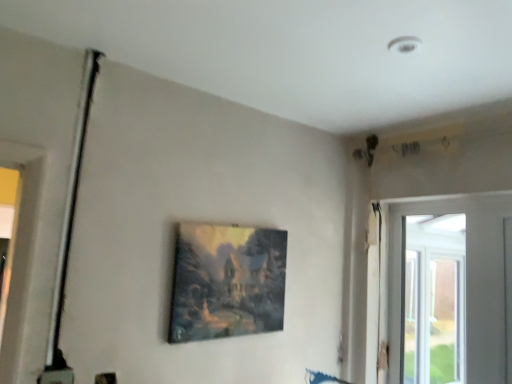
Question: Considering the relative positions of transparent glass window at right and matte wooden picture frame at center in the image provided, is transparent glass window at right to the right of matte wooden picture frame at center from the viewer's perspective?

Choices:
 (A) yes
 (B) no

Answer: (A)

Question: Considering the relative sizes of transparent glass window at right and matte wooden picture frame at center in the image provided, is transparent glass window at right wider than matte wooden picture frame at center?

Choices:
 (A) no
 (B) yes

Answer: (A)

Question: Is transparent glass window at right oriented away from matte wooden picture frame at center?

Choices:
 (A) yes
 (B) no

Answer: (B)

Question: From the image's perspective, does transparent glass window at right appear higher than matte wooden picture frame at center?

Choices:
 (A) yes
 (B) no

Answer: (B)

Question: Considering the relative sizes of transparent glass window at right and matte wooden picture frame at center in the image provided, is transparent glass window at right smaller than matte wooden picture frame at center?

Choices:
 (A) yes
 (B) no

Answer: (B)

Question: Can you confirm if transparent glass window at right is bigger than matte wooden picture frame at center?

Choices:
 (A) yes
 (B) no

Answer: (A)

Question: Is matte wooden picture frame at center not near transparent glass window at right?

Choices:
 (A) no
 (B) yes

Answer: (B)

Question: Is matte wooden picture frame at center to the right of transparent glass window at right from the viewer's perspective?

Choices:
 (A) yes
 (B) no

Answer: (B)

Question: Is matte wooden picture frame at center behind transparent glass window at right?

Choices:
 (A) no
 (B) yes

Answer: (A)

Question: Is matte wooden picture frame at center bigger than transparent glass window at right?

Choices:
 (A) no
 (B) yes

Answer: (A)

Question: From a real-world perspective, is matte wooden picture frame at center physically below transparent glass window at right?

Choices:
 (A) no
 (B) yes

Answer: (A)

Question: Is matte wooden picture frame at center in front of transparent glass window at right?

Choices:
 (A) no
 (B) yes

Answer: (B)

Question: In terms of width, does matte wooden picture frame at center look wider or thinner when compared to transparent glass window at right?

Choices:
 (A) wide
 (B) thin

Answer: (A)